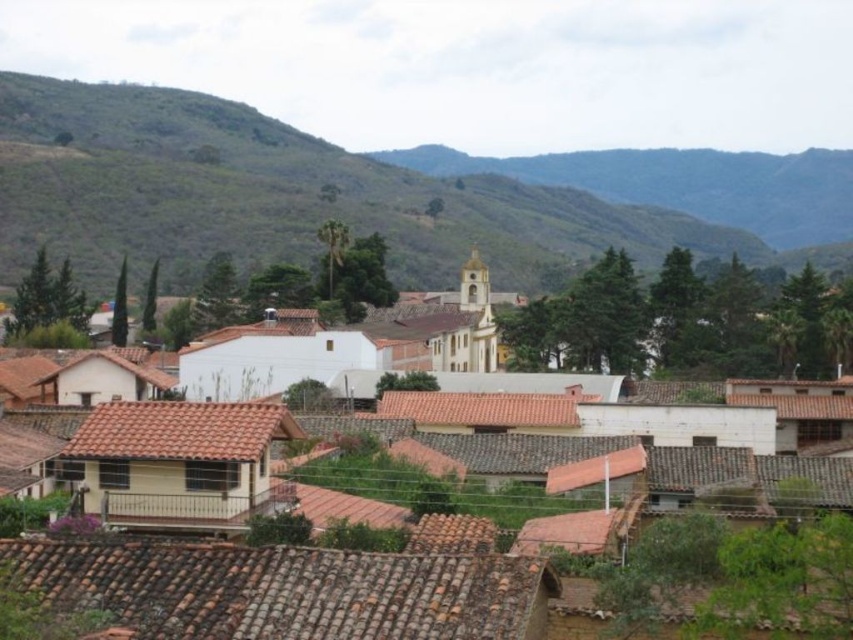
Question: Is white matte building at center further to the viewer compared to green grassy hillside at upper center?

Choices:
 (A) no
 (B) yes

Answer: (A)

Question: Is white matte building at center further to camera compared to green grassy hillside at upper center?

Choices:
 (A) yes
 (B) no

Answer: (B)

Question: Which of the following is the farthest from the observer?

Choices:
 (A) green grassy hillside at upper center
 (B) white matte building at center

Answer: (A)

Question: Is white matte building at center bigger than green grassy hillside at upper center?

Choices:
 (A) yes
 (B) no

Answer: (B)